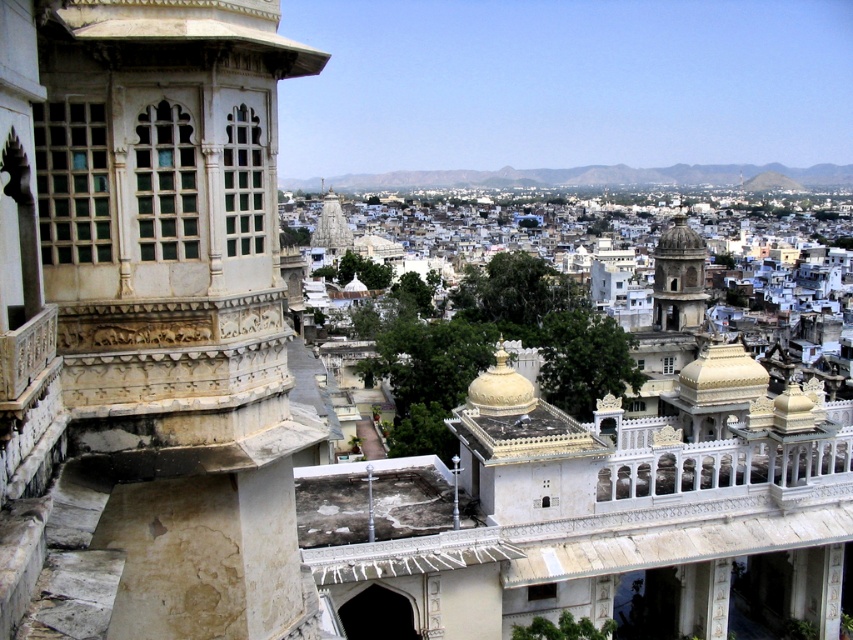
Is white marble palace at center smaller than white marble temple at center?

No.

Between point (366, 568) and point (335, 195), which one is positioned in front?

Point (366, 568) is more forward.

At what (x,y) coordinates should I click in order to perform the action: click on white marble palace at center. Please return your answer as a coordinate pair (x, y). This screenshot has width=853, height=640. Looking at the image, I should click on (622, 506).

How distant is smooth stone tower at center-right from white marble temple at center?

A distance of 178.84 meters exists between smooth stone tower at center-right and white marble temple at center.

Can you confirm if smooth stone tower at center-right is bigger than white marble temple at center?

No.

Who is more distant from viewer, (662, 321) or (318, 218)?

Positioned behind is point (318, 218).

This screenshot has height=640, width=853. What are the coordinates of `smooth stone tower at center-right` in the screenshot? It's located at (677, 278).

Can you confirm if white marble palace at center is positioned above smooth stone tower at center-right?

No.

Is white marble palace at center shorter than smooth stone tower at center-right?

Incorrect, white marble palace at center's height does not fall short of smooth stone tower at center-right's.

Which is behind, point (514, 525) or point (666, 284)?

Point (666, 284)

At what (x,y) coordinates should I click in order to perform the action: click on white marble palace at center. Please return your answer as a coordinate pair (x, y). The height and width of the screenshot is (640, 853). Looking at the image, I should click on (622, 506).